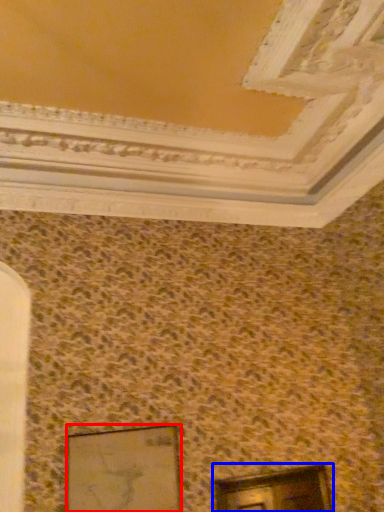
Question: Which object appears closest to the camera in this image, picture frame (highlighted by a red box) or window (highlighted by a blue box)?

Choices:
 (A) picture frame
 (B) window

Answer: (A)